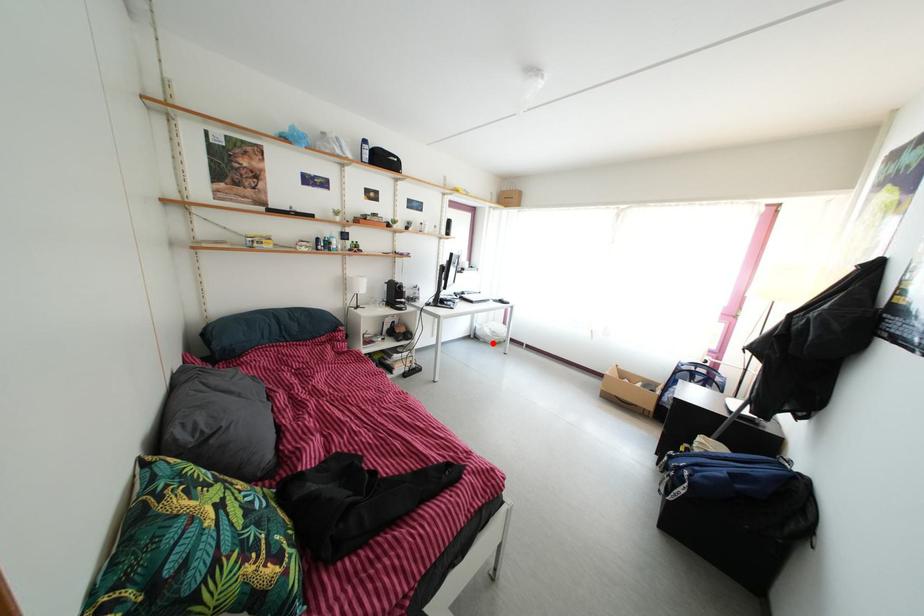
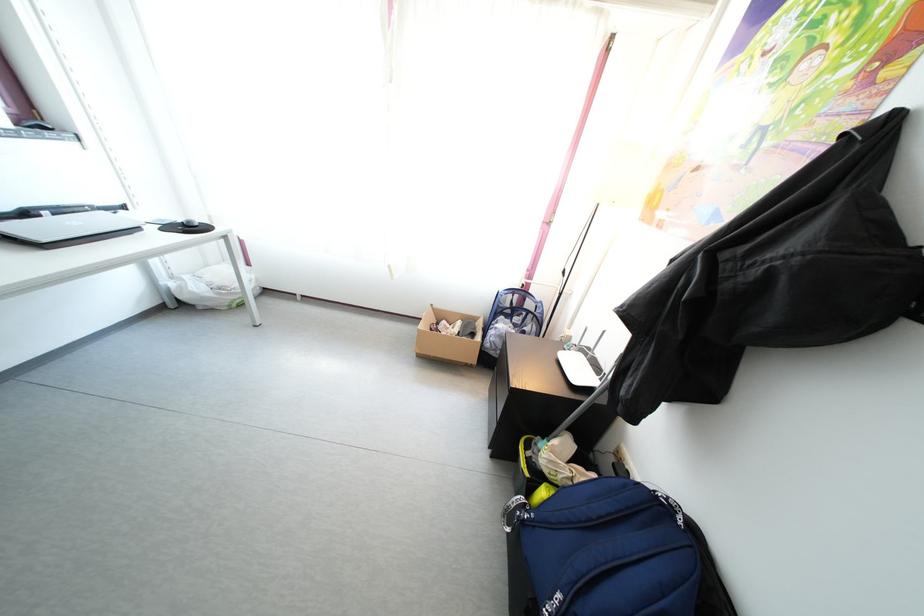
In the second image, find the point that corresponds to the highlighted location in the first image.

(210, 306)